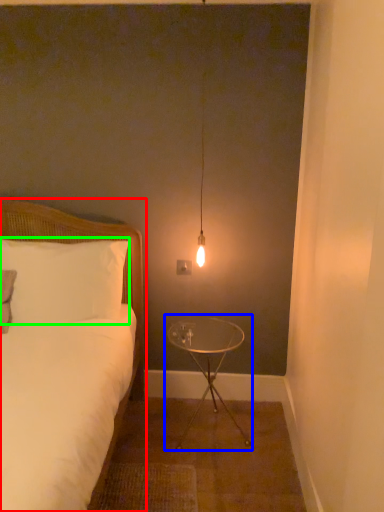
Question: Estimate the real-world distances between objects in this image. Which object is closer to bed (highlighted by a red box), table (highlighted by a blue box) or pillow (highlighted by a green box)?

Choices:
 (A) table
 (B) pillow

Answer: (B)